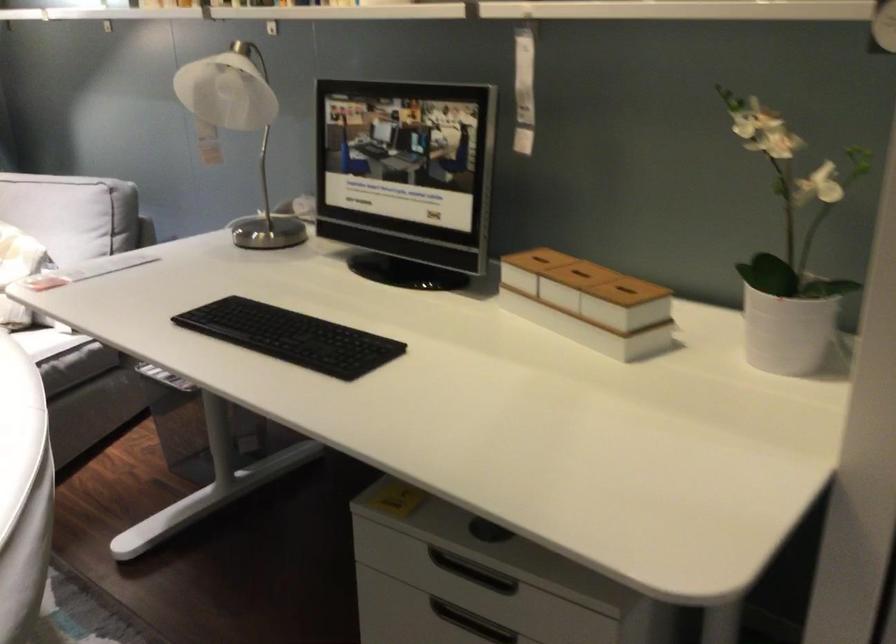
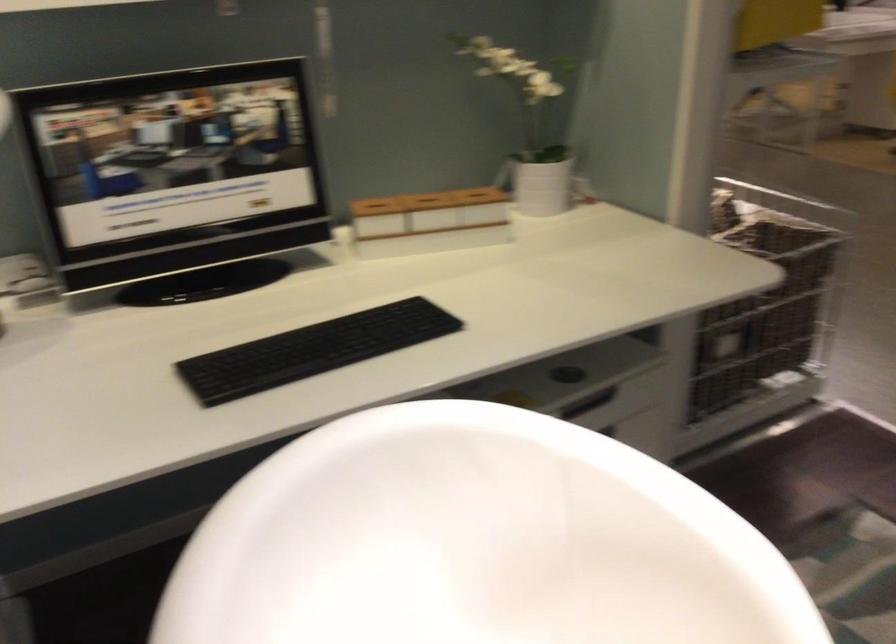
Where in the second image is the point corresponding to [455,554] from the first image?

(588, 402)